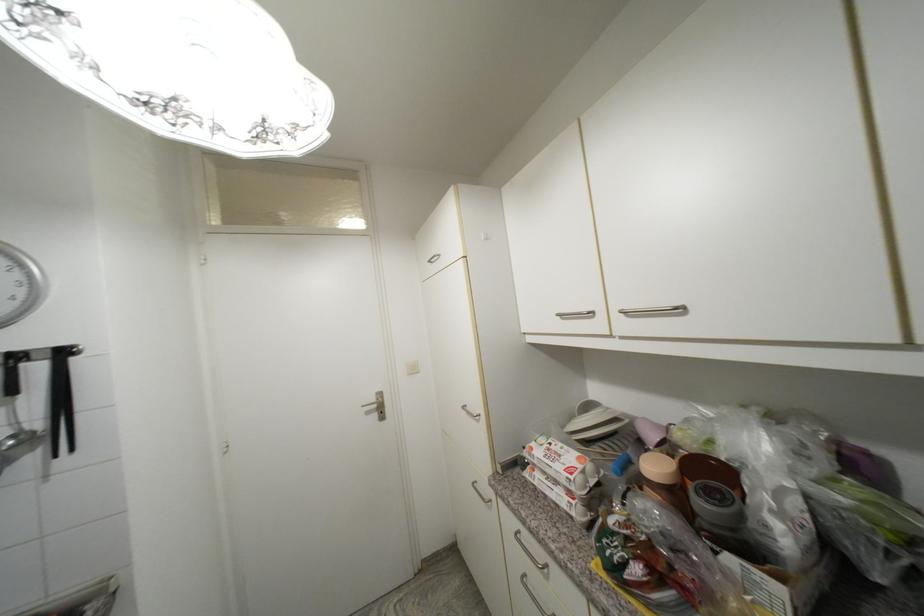
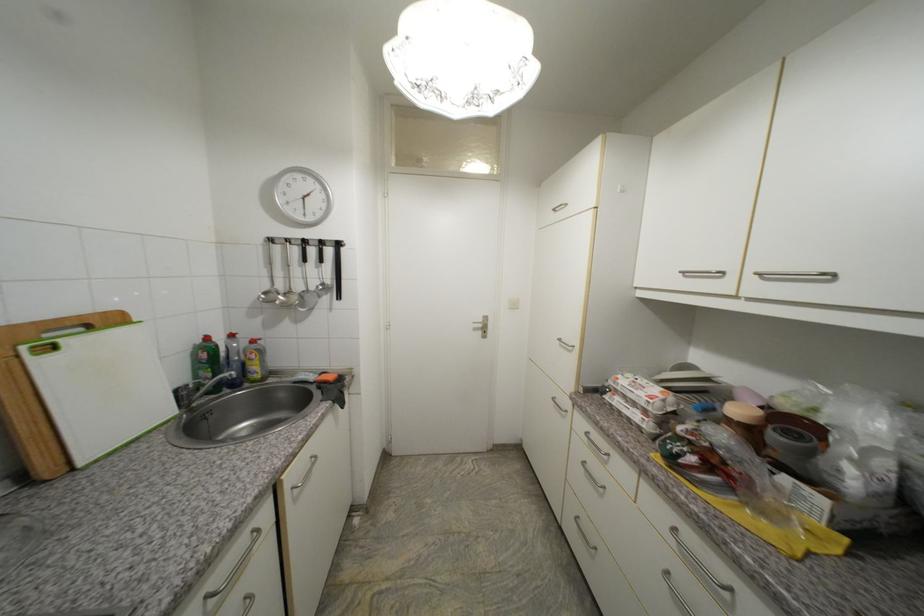
In the second image, find the point that corresponds to point 594,314 in the first image.

(724, 274)